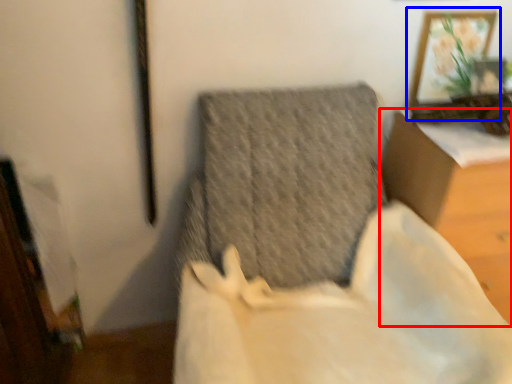
Question: Which point is closer to the camera, furniture (highlighted by a red box) or picture frame (highlighted by a blue box)?

Choices:
 (A) furniture
 (B) picture frame

Answer: (A)